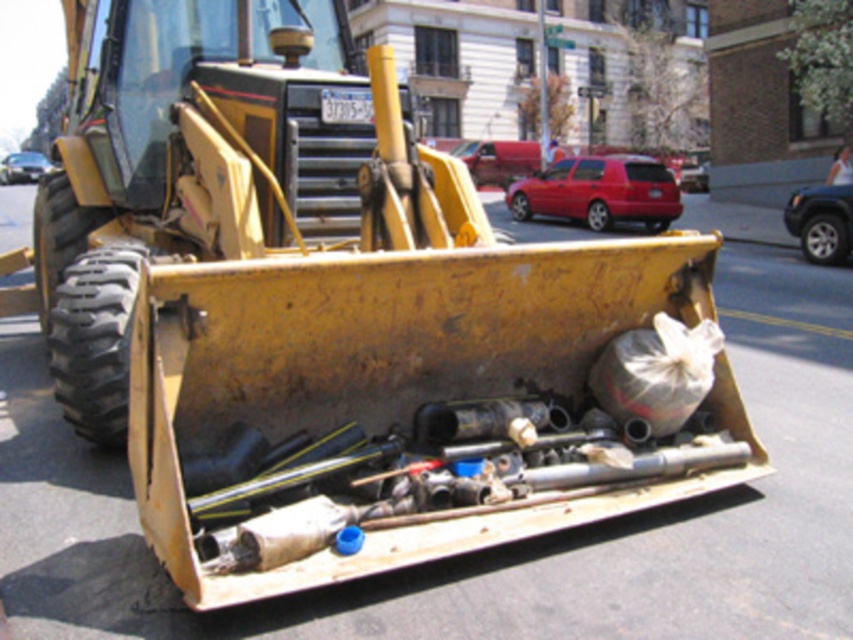
Between matte red car at center and metallic silver car at left, which one has less height?

With less height is matte red car at center.

Can you confirm if matte red car at center is bigger than metallic silver car at left?

Actually, matte red car at center might be smaller than metallic silver car at left.

What do you see at coordinates (599, 193) in the screenshot?
I see `matte red car at center` at bounding box center [599, 193].

Where is `matte red car at center`? This screenshot has width=853, height=640. matte red car at center is located at coordinates (599, 193).

Is point (529, 193) positioned in front of point (811, 202)?

No.

Between point (550, 192) and point (805, 218), which one is positioned in front?

Positioned in front is point (805, 218).

The image size is (853, 640). In order to click on matte red car at center in this screenshot , I will do `click(599, 193)`.

Does metallic blue suv at right come in front of metallic silver car at left?

Yes.

Which is in front, point (845, 227) or point (12, 166)?

Point (845, 227) is in front.

Which is behind, point (830, 184) or point (10, 164)?

The point (10, 164) is behind.

This screenshot has width=853, height=640. Find the location of `metallic blue suv at right`. metallic blue suv at right is located at coordinates (824, 214).